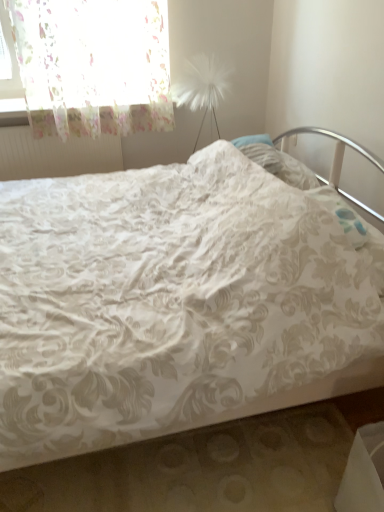
Question: Considering the relative positions of white floral fabric bed at center and translucent floral fabric at upper left in the image provided, is white floral fabric bed at center behind translucent floral fabric at upper left?

Choices:
 (A) no
 (B) yes

Answer: (A)

Question: Is white floral fabric bed at center wider than translucent floral fabric at upper left?

Choices:
 (A) no
 (B) yes

Answer: (B)

Question: Is white floral fabric bed at center to the left of translucent floral fabric at upper left from the viewer's perspective?

Choices:
 (A) yes
 (B) no

Answer: (B)

Question: Can you confirm if white floral fabric bed at center is taller than translucent floral fabric at upper left?

Choices:
 (A) yes
 (B) no

Answer: (A)

Question: Would you consider white floral fabric bed at center to be distant from translucent floral fabric at upper left?

Choices:
 (A) yes
 (B) no

Answer: (A)

Question: Is white floral fabric bed at center facing towards translucent floral fabric at upper left?

Choices:
 (A) yes
 (B) no

Answer: (B)

Question: Considering the relative sizes of white textured radiator at upper left and translucent floral fabric at upper left in the image provided, is white textured radiator at upper left smaller than translucent floral fabric at upper left?

Choices:
 (A) yes
 (B) no

Answer: (A)

Question: Is white textured radiator at upper left positioned far away from translucent floral fabric at upper left?

Choices:
 (A) no
 (B) yes

Answer: (A)

Question: From the image's perspective, does white textured radiator at upper left appear higher than translucent floral fabric at upper left?

Choices:
 (A) yes
 (B) no

Answer: (B)

Question: Considering the relative sizes of white textured radiator at upper left and translucent floral fabric at upper left in the image provided, is white textured radiator at upper left bigger than translucent floral fabric at upper left?

Choices:
 (A) yes
 (B) no

Answer: (B)

Question: Is white textured radiator at upper left facing towards translucent floral fabric at upper left?

Choices:
 (A) yes
 (B) no

Answer: (B)

Question: Is white textured radiator at upper left looking in the opposite direction of translucent floral fabric at upper left?

Choices:
 (A) yes
 (B) no

Answer: (B)

Question: Is white textured radiator at upper left oriented away from white floral fabric bed at center?

Choices:
 (A) no
 (B) yes

Answer: (A)